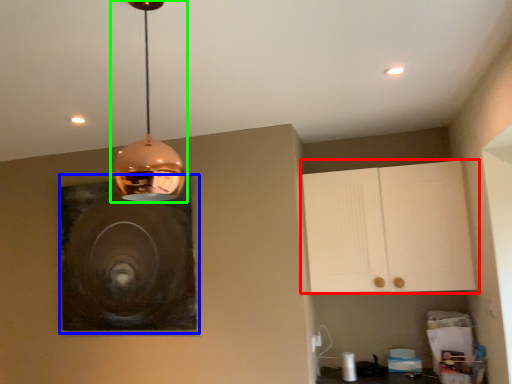
Question: Which object is the farthest from cabinetry (highlighted by a red box)? Choose among these: picture frame (highlighted by a blue box) or lamp (highlighted by a green box).

Choices:
 (A) picture frame
 (B) lamp

Answer: (B)